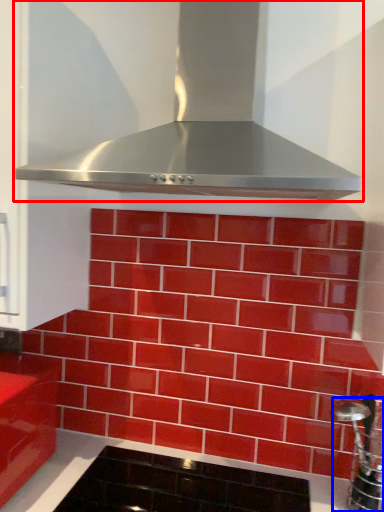
Question: Which object appears closest to the camera in this image, home appliance (highlighted by a red box) or stainless steel (highlighted by a blue box)?

Choices:
 (A) home appliance
 (B) stainless steel

Answer: (A)